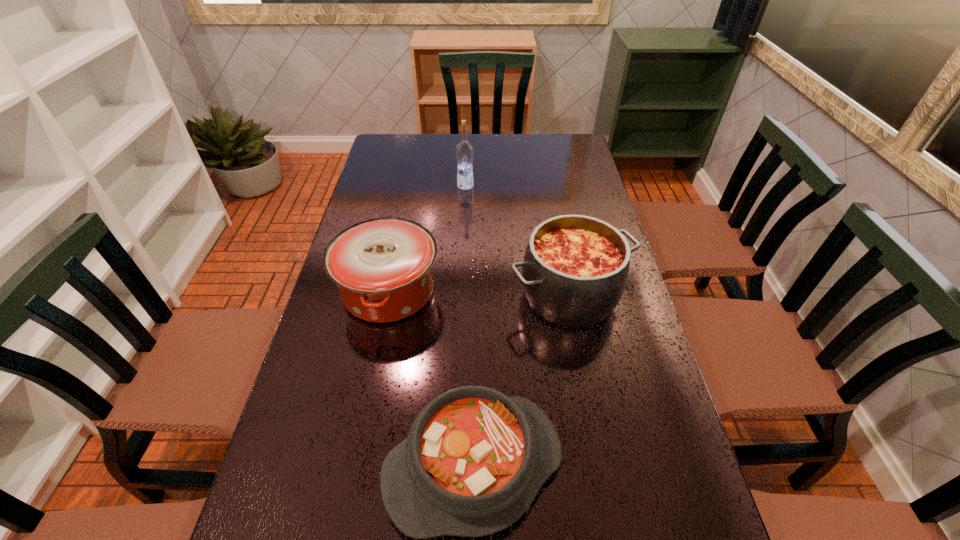
Choose which object is the nearest neighbor to the farthest object. Please provide its 2D coordinates. Your answer should be formatted as a tuple, i.e. [(x, y)], where the tuple contains the x and y coordinates of a point satisfying the conditions above.

[(383, 268)]

Select which casserole is the closest to the farthest object. Please provide its 2D coordinates. Your answer should be formatted as a tuple, i.e. [(x, y)], where the tuple contains the x and y coordinates of a point satisfying the conditions above.

[(383, 268)]

Find the location of `casserole identified as the closest to the nearest casserole`. casserole identified as the closest to the nearest casserole is located at coordinates (383, 268).